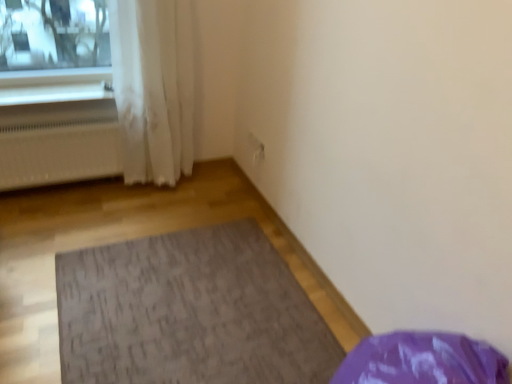
Question: Is white plastic window sill at upper left far from white matte radiator at left?

Choices:
 (A) no
 (B) yes

Answer: (A)

Question: From a real-world perspective, is white plastic window sill at upper left positioned over white matte radiator at left based on gravity?

Choices:
 (A) no
 (B) yes

Answer: (B)

Question: Is white plastic window sill at upper left completely or partially outside of white matte radiator at left?

Choices:
 (A) yes
 (B) no

Answer: (A)

Question: Considering the relative sizes of white plastic window sill at upper left and white matte radiator at left in the image provided, is white plastic window sill at upper left bigger than white matte radiator at left?

Choices:
 (A) yes
 (B) no

Answer: (B)

Question: Is white plastic window sill at upper left beside white matte radiator at left?

Choices:
 (A) yes
 (B) no

Answer: (B)

Question: Does white plastic window sill at upper left have a greater height compared to white matte radiator at left?

Choices:
 (A) no
 (B) yes

Answer: (A)

Question: Does white sheer curtain at left appear on the right side of textured gray mat at center?

Choices:
 (A) yes
 (B) no

Answer: (B)

Question: From the image's perspective, is white sheer curtain at left under textured gray mat at center?

Choices:
 (A) yes
 (B) no

Answer: (B)

Question: Is white sheer curtain at left not near textured gray mat at center?

Choices:
 (A) yes
 (B) no

Answer: (B)

Question: Can you confirm if white sheer curtain at left is taller than textured gray mat at center?

Choices:
 (A) yes
 (B) no

Answer: (A)

Question: Is textured gray mat at center located within white sheer curtain at left?

Choices:
 (A) no
 (B) yes

Answer: (A)

Question: Is white sheer curtain at left wider than textured gray mat at center?

Choices:
 (A) yes
 (B) no

Answer: (B)

Question: Is white sheer curtain at left further to camera compared to white matte radiator at left?

Choices:
 (A) no
 (B) yes

Answer: (A)